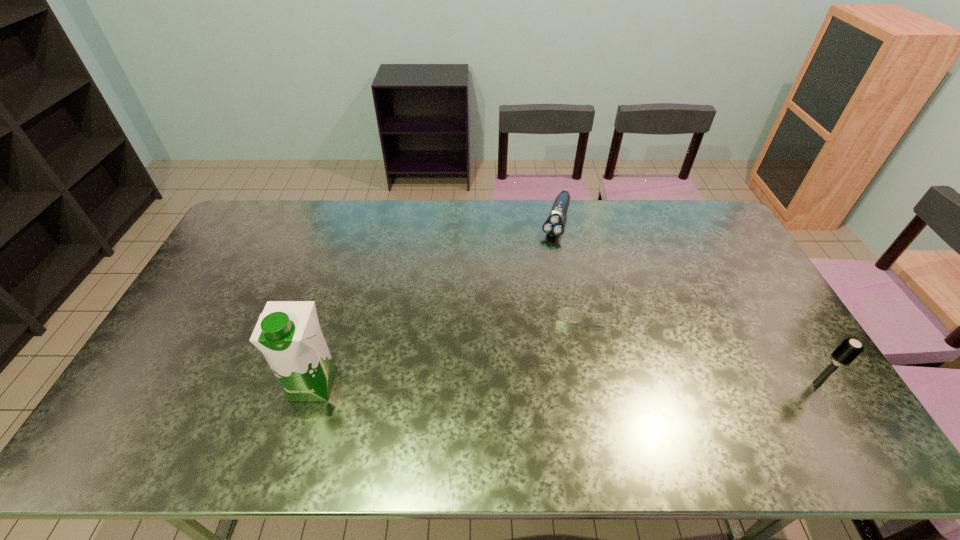
I want to click on free space on the desktop that is between the soya milk and the hairbrush and is positioned on the front-facing side of the second farthest object, so pos(588,383).

This screenshot has height=540, width=960. I want to click on free space on the desktop that is between the soya milk and the third shortest object and is positioned on the head of the electric shaver, so click(x=497, y=383).